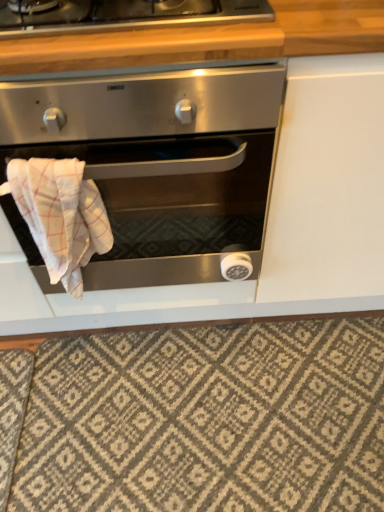
Identify the location of vacant region below patterned carpet at lower center (from a real-world perspective). Image resolution: width=384 pixels, height=512 pixels. (218, 408).